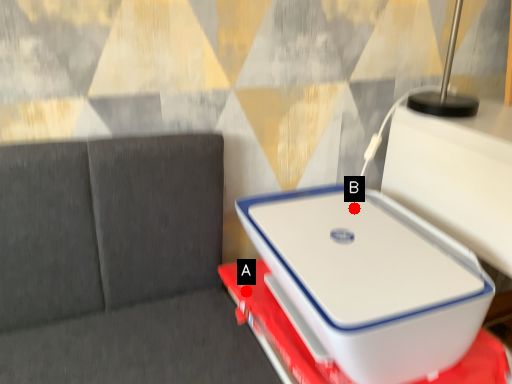
Question: Two points are circled on the image, labeled by A and B beside each circle. Which point is closer to the camera taking this photo?

Choices:
 (A) A is closer
 (B) B is closer

Answer: (A)